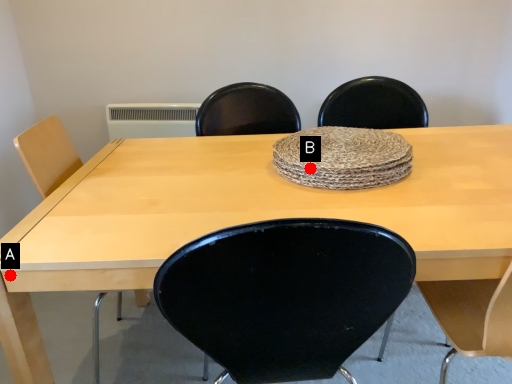
Question: Two points are circled on the image, labeled by A and B beside each circle. Which point is closer to the camera?

Choices:
 (A) A is closer
 (B) B is closer

Answer: (A)